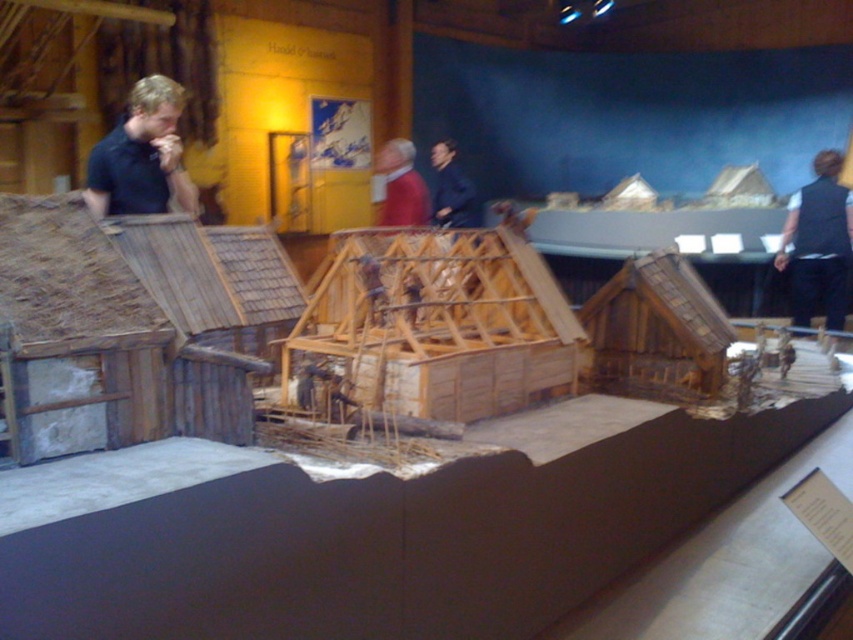
Consider the image. You are standing in front of the medieval model village. You see the wooden frame hut at center and the matte black shirt at left. Which object is positioned lower in the scene?

The wooden frame hut at center is positioned lower than the matte black shirt at left.

You are a tour guide explaining the medieval village model to visitors. You point out the thatched wood hut at left and the dark blue jacket at center. Which object is larger in size?

The thatched wood hut at left is bigger than the dark blue jacket at center.